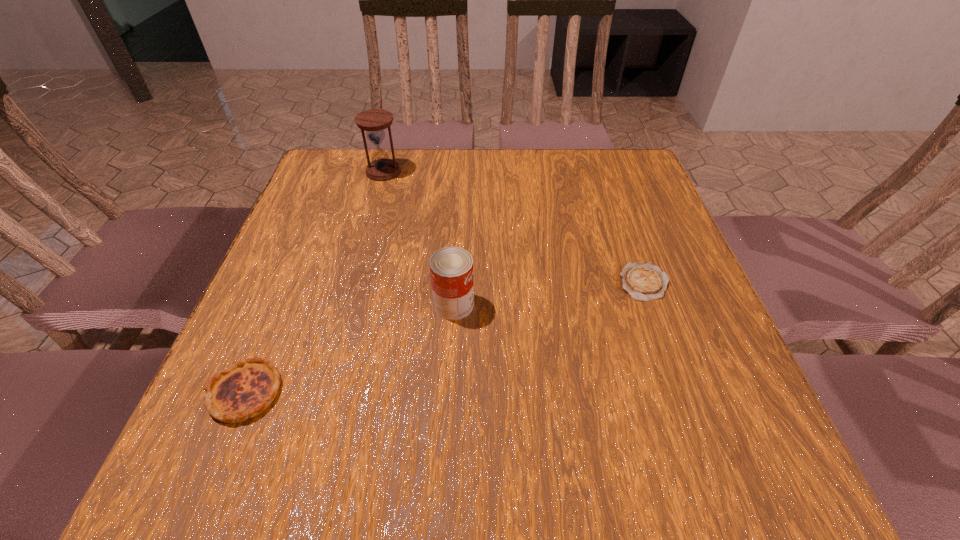
What are the coordinates of `the tallest object` in the screenshot? It's located at (374, 121).

The width and height of the screenshot is (960, 540). What are the coordinates of `the farthest object` in the screenshot? It's located at (374, 121).

Locate an element on the screen. The width and height of the screenshot is (960, 540). can is located at coordinates (451, 268).

Locate an element on the screen. the third object from left to right is located at coordinates coord(451,268).

I want to click on the second shortest object, so click(245, 389).

Where is `the nearer quiche`? This screenshot has width=960, height=540. the nearer quiche is located at coordinates (245, 389).

The image size is (960, 540). Identify the location of the farther quiche. (644, 281).

Where is `the right quiche`? This screenshot has height=540, width=960. the right quiche is located at coordinates (644, 281).

The height and width of the screenshot is (540, 960). I want to click on free space located on the front of the hourglass, so click(x=369, y=227).

This screenshot has width=960, height=540. In order to click on free region located on the front label of the second tallest object in this screenshot , I will do `click(504, 305)`.